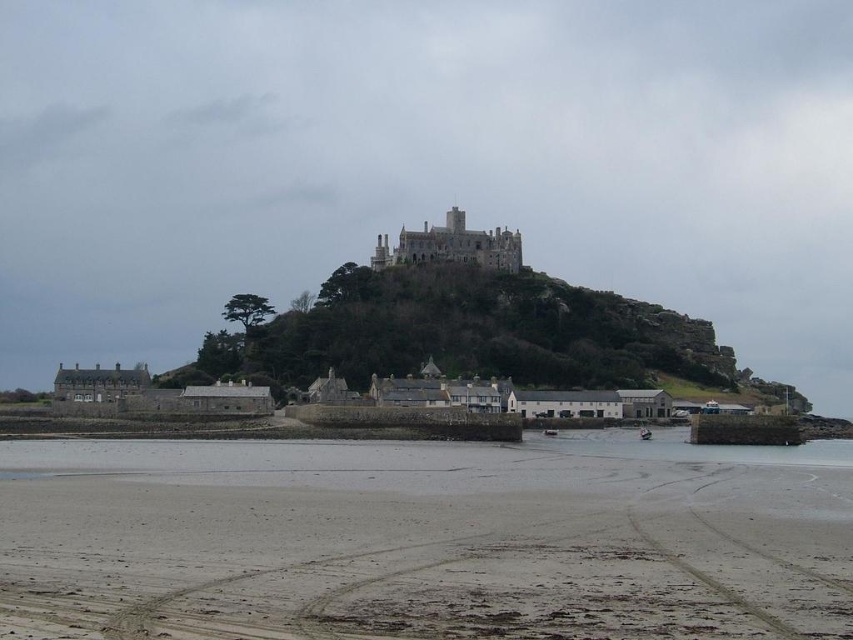
You are standing at the base of the castle hill and see two points marked in the image. The first point is at coordinate point(1, 573) and the second is at point(685, 429). From your current position, which point is closer to you?

Point(1, 573) is in front of point(685, 429), so it is closer to you.

You are a tourist standing on the sandy beach at lower center and want to reach the clear water at lower center to swim. Is the path between them accessible?

The sandy beach at lower center is in front of clear water at lower center, so you can walk directly to the clear water at lower center from the sandy beach at lower center as they are adjacent.